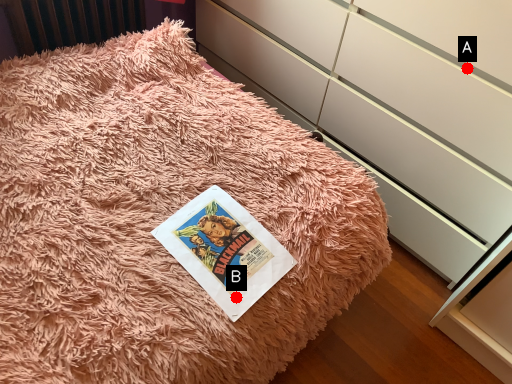
Question: Two points are circled on the image, labeled by A and B beside each circle. Which point appears farthest from the camera in this image?

Choices:
 (A) A is further
 (B) B is further

Answer: (A)